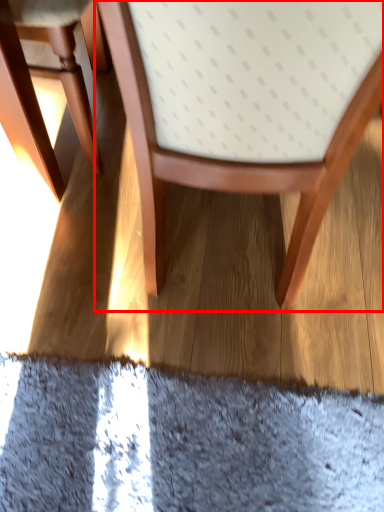
Question: Where is chair (annotated by the red box) located in relation to chair in the image?

Choices:
 (A) right
 (B) left

Answer: (A)